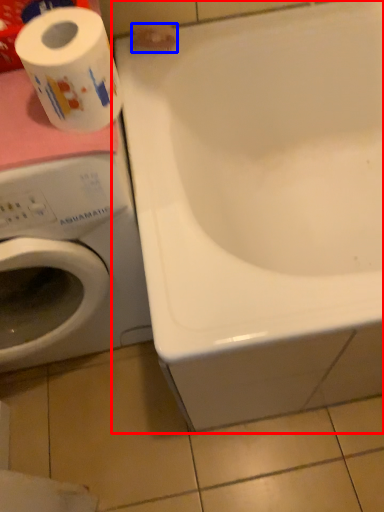
Question: Which point is closer to the camera, bathtub (highlighted by a red box) or toilet paper (highlighted by a blue box)?

Choices:
 (A) bathtub
 (B) toilet paper

Answer: (A)